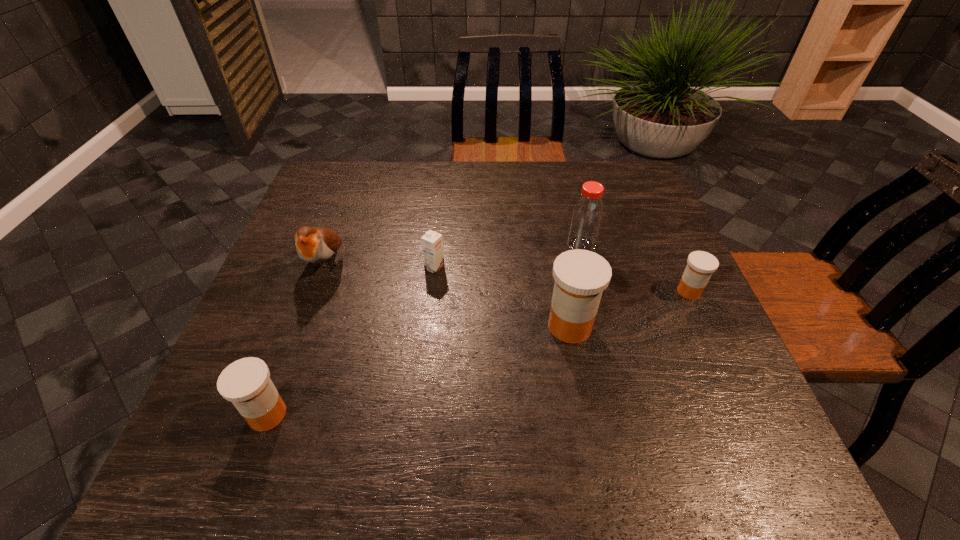
Locate an element on the screen. The width and height of the screenshot is (960, 540). vacant area that lies between the rightmost object and the bird is located at coordinates (507, 278).

In order to click on blank region between the nearest object and the bottle in this screenshot , I will do `click(424, 330)`.

You are a GUI agent. You are given a task and a screenshot of the screen. Output one action in this format:
    pyautogui.click(x=<x>, y=<y>)
    Task: Click on the unoccupied area between the leftmost medicine and the farthest medicine
    The height and width of the screenshot is (540, 960).
    Given the screenshot: What is the action you would take?
    pyautogui.click(x=478, y=353)

This screenshot has height=540, width=960. In order to click on free space between the farthest medicine and the bird in this screenshot , I will do `click(507, 278)`.

Where is `free space between the bottle and the bird`? free space between the bottle and the bird is located at coordinates click(453, 254).

Locate an element on the screen. Image resolution: width=960 pixels, height=540 pixels. free space between the chocolate milk and the bird is located at coordinates (380, 266).

Locate an element on the screen. unoccupied area between the bird and the second nearest object is located at coordinates (447, 295).

Locate an element on the screen. unoccupied area between the nearest object and the bird is located at coordinates (297, 339).

Locate which object ranks fourth in proximity to the bottle. Please provide its 2D coordinates. Your answer should be formatted as a tuple, i.e. [(x, y)], where the tuple contains the x and y coordinates of a point satisfying the conditions above.

[(316, 245)]

At what (x,y) coordinates should I click in order to perform the action: click on object that is the fourth closest to the rightmost object. Please return your answer as a coordinate pair (x, y). The image size is (960, 540). Looking at the image, I should click on (316, 245).